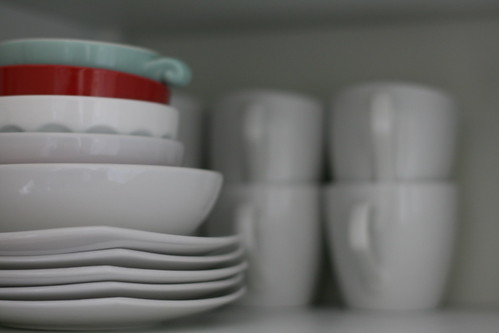
Identify the location of handle. (357, 219), (249, 219), (385, 123), (255, 128), (174, 70).